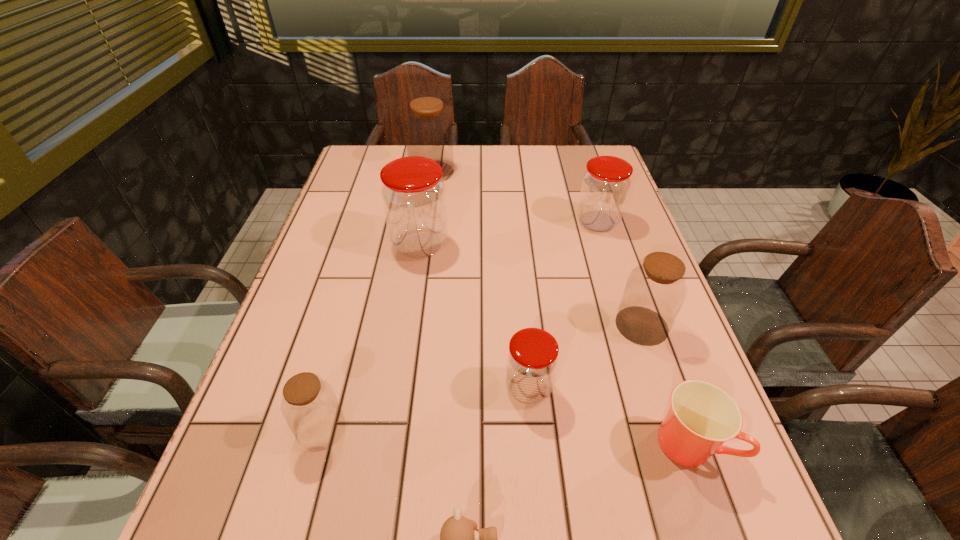
The image size is (960, 540). I want to click on brown jar that is the closest to the cup, so click(655, 290).

At what (x,y) coordinates should I click in order to perform the action: click on red jar that stands as the closest to the second farthest brown jar. Please return your answer as a coordinate pair (x, y). Image resolution: width=960 pixels, height=540 pixels. Looking at the image, I should click on (532, 359).

In order to click on the third closest red jar to the second nearest brown jar in this screenshot , I will do `click(413, 194)`.

Image resolution: width=960 pixels, height=540 pixels. I want to click on free space that satisfies the following two spatial constraints: 1. on the front side of the cup; 2. on the left side of the leftmost brown jar, so 318,443.

The height and width of the screenshot is (540, 960). I want to click on free space in the image that satisfies the following two spatial constraints: 1. on the back side of the nearest red jar; 2. on the left side of the third nearest jar, so click(522, 325).